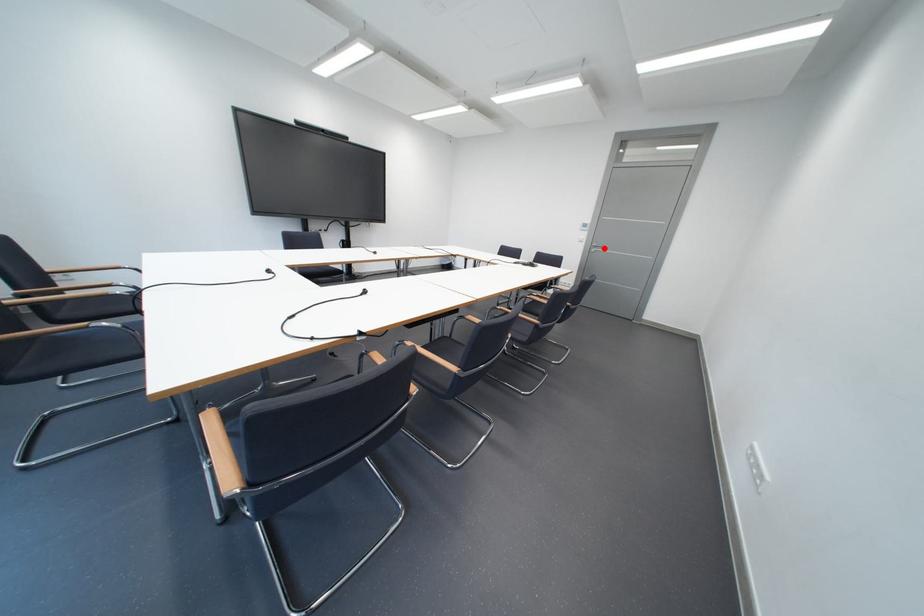
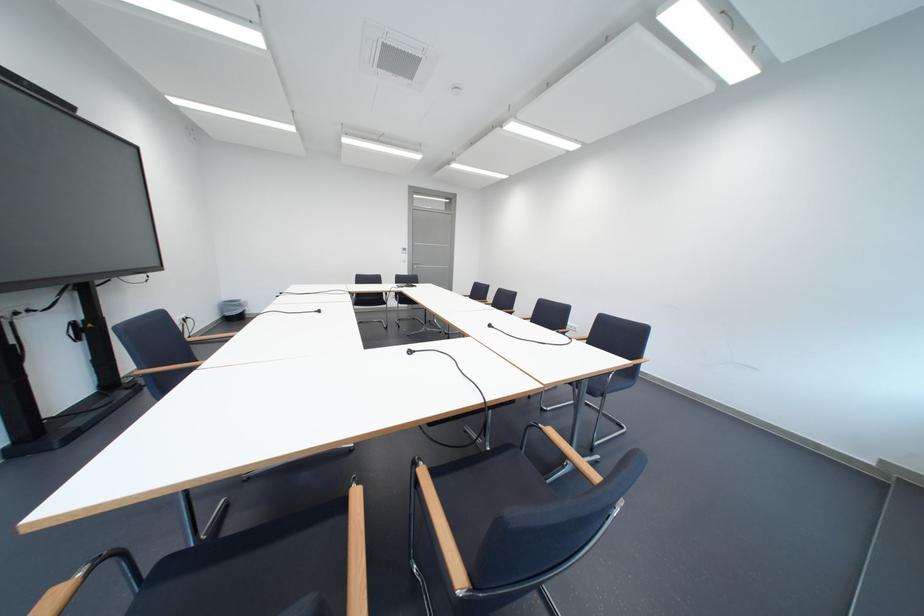
In the second image, find the point that corresponds to the highlighted location in the first image.

(426, 265)